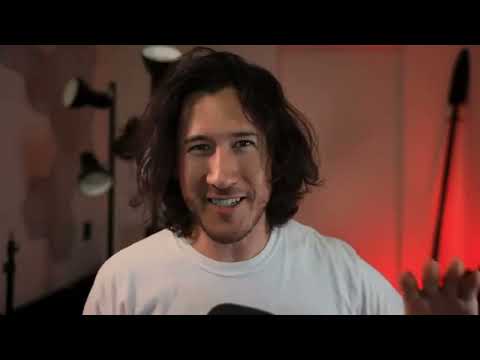
Find the location of a particular element. red light on the back wall is located at coordinates (454, 238).